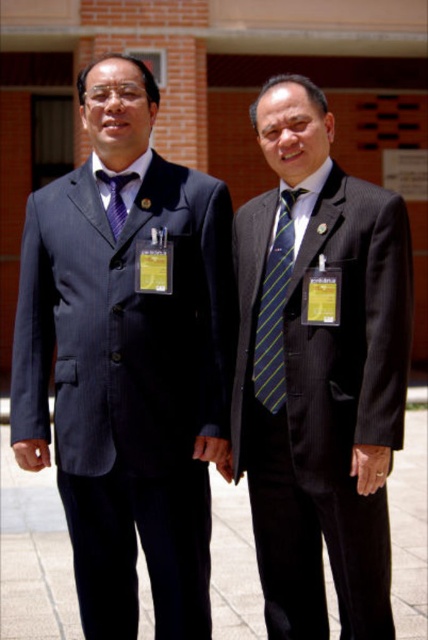
Which is more to the right, matte black suit at left or dark pinstripe suit at center?

dark pinstripe suit at center

Who is more distant from viewer, (207, 212) or (347, 534)?

The point (207, 212) is more distant.

Does point (89, 531) come in front of point (273, 292)?

No, it is behind (273, 292).

At what (x,y) coordinates should I click in order to perform the action: click on matte black suit at left. Please return your answer as a coordinate pair (x, y). Looking at the image, I should click on (128, 385).

From the picture: Which is below, green striped tie at center or matte purple tie at left?

green striped tie at center is below.

Measure the distance between point (276, 344) and camera.

Point (276, 344) and camera are 14.44 feet apart.

The height and width of the screenshot is (640, 428). What are the coordinates of `green striped tie at center` in the screenshot? It's located at (275, 308).

Between dark pinstripe suit at center and green striped tie at center, which one is positioned higher?

green striped tie at center is above.

Does dark pinstripe suit at center have a smaller size compared to green striped tie at center?

No, dark pinstripe suit at center is not smaller than green striped tie at center.

Identify the location of dark pinstripe suit at center. (318, 372).